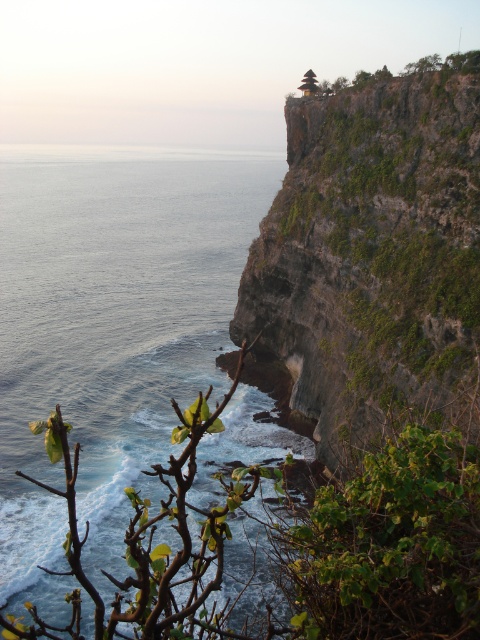
Does blue water at center have a smaller size compared to green mossy cliff at upper right?

Incorrect, blue water at center is not smaller in size than green mossy cliff at upper right.

You are a GUI agent. You are given a task and a screenshot of the screen. Output one action in this format:
    pyautogui.click(x=<x>, y=<y>)
    Task: Click on the blue water at center
    
    Given the screenshot: What is the action you would take?
    pyautogui.click(x=108, y=332)

Locate an element on the screen. This screenshot has height=640, width=480. blue water at center is located at coordinates [x=108, y=332].